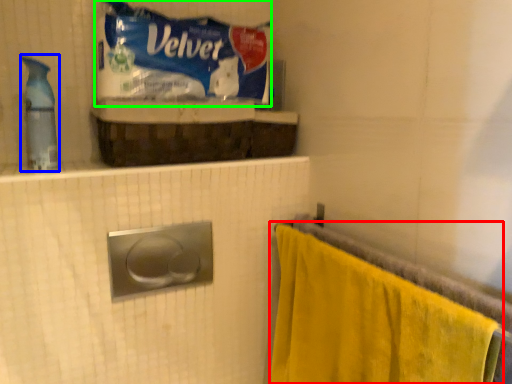
Question: Which object is positioned farthest from towel (highlighted by a red box)? Select from cleaning product (highlighted by a blue box) and material (highlighted by a green box).

Choices:
 (A) cleaning product
 (B) material

Answer: (A)